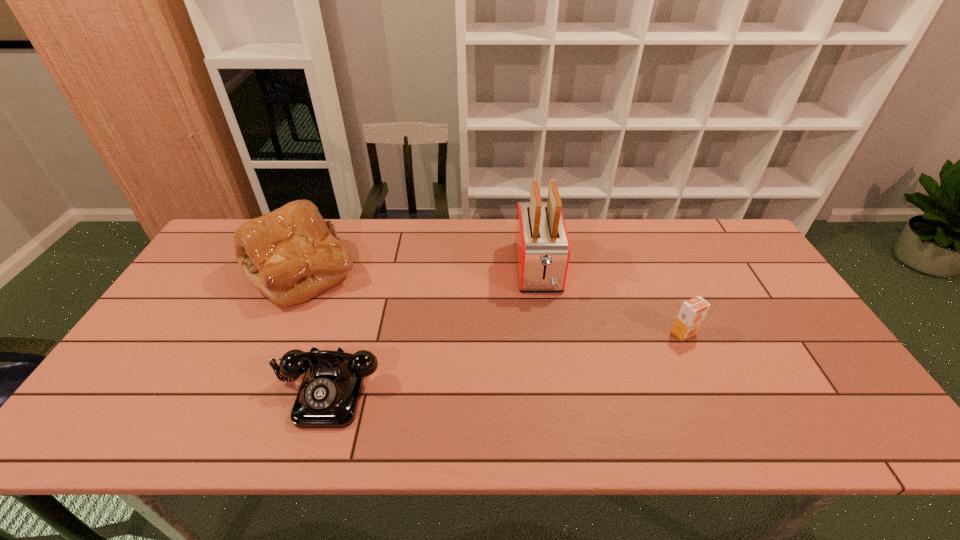
Where is `blank region between the second object from right to left and the nearest object`? blank region between the second object from right to left and the nearest object is located at coordinates (433, 329).

Image resolution: width=960 pixels, height=540 pixels. Identify the location of vacant area that lies between the nearest object and the third shortest object. (315, 330).

Find the location of `free space between the second nearest object and the toaster`. free space between the second nearest object and the toaster is located at coordinates (611, 301).

Identify the location of vacant area that lies between the orange juice and the telephone. (506, 361).

At what (x,y) coordinates should I click in order to perform the action: click on free space between the rightmost object and the nearest object. Please return your answer as a coordinate pair (x, y). This screenshot has width=960, height=540. Looking at the image, I should click on (506, 361).

What are the coordinates of `vacant area that lies between the third farthest object and the tallest object` in the screenshot? It's located at (611, 301).

This screenshot has width=960, height=540. Find the location of `vacant space in between the toaster and the third shortest object`. vacant space in between the toaster and the third shortest object is located at coordinates (420, 270).

Identify the location of vacant area that lies between the third farthest object and the toaster. (611, 301).

Locate an element on the screen. The width and height of the screenshot is (960, 540). vacant area that lies between the third shortest object and the nearest object is located at coordinates (315, 330).

You are a GUI agent. You are given a task and a screenshot of the screen. Output one action in this format:
    pyautogui.click(x=<x>, y=<y>)
    Task: Click on the object that stands as the third closest to the bread
    Image resolution: width=960 pixels, height=540 pixels.
    Given the screenshot: What is the action you would take?
    pyautogui.click(x=693, y=311)